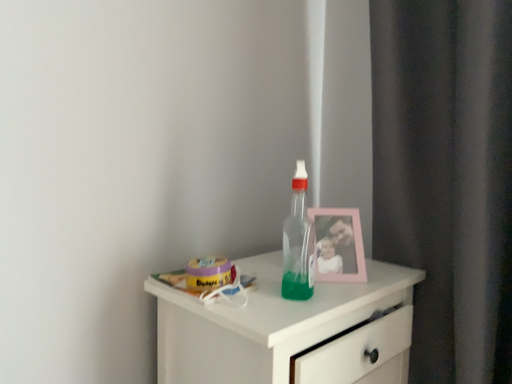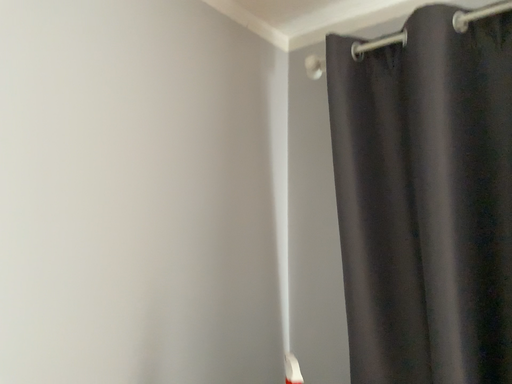
Question: Which way did the camera rotate in the video?

Choices:
 (A) rotated right
 (B) rotated left

Answer: (A)